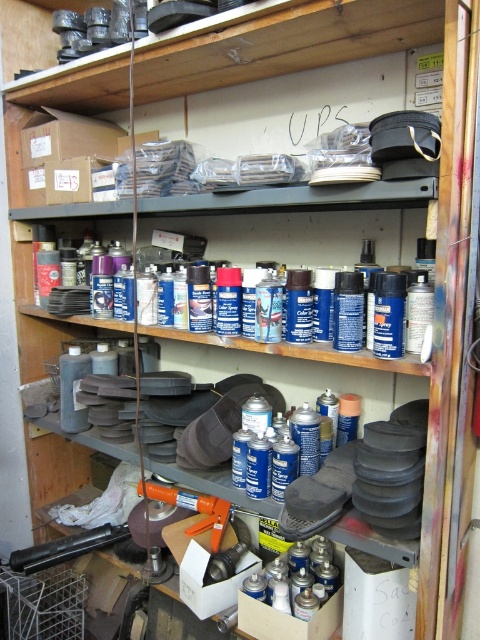
You are organizing the workshop and need to retrieve the orange plastic caulking gun at center. However, the blue matte spray cans at center are blocking the way. Can you remove the spray cans to access the caulking gun?

The blue matte spray cans at center is positioned over orange plastic caulking gun at center, so you can remove the blue matte spray cans at center to access the orange plastic caulking gun at center.